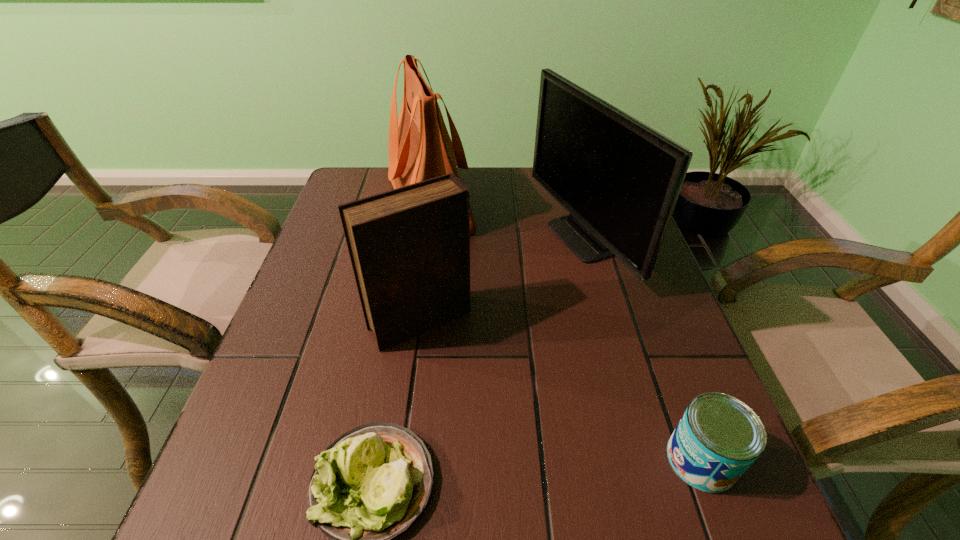
This screenshot has width=960, height=540. Identify the location of vacant point at the near edge. (433, 531).

I want to click on free space at the left edge of the desktop, so click(x=289, y=480).

Where is `free space at the right edge`? The width and height of the screenshot is (960, 540). free space at the right edge is located at coordinates [x=599, y=287].

In the image, there is a desktop. What are the coordinates of `vacant space at the near left corner` in the screenshot? It's located at (244, 500).

You are a GUI agent. You are given a task and a screenshot of the screen. Output one action in this format:
    pyautogui.click(x=<x>, y=<y>)
    Task: Click on the free space at the near right corner of the desktop
    This screenshot has height=540, width=960.
    Given the screenshot: What is the action you would take?
    pyautogui.click(x=721, y=529)

Image resolution: width=960 pixels, height=540 pixels. In order to click on vacant area that lies between the fourth tallest object and the third shortest object in this screenshot , I will do tap(561, 390).

Image resolution: width=960 pixels, height=540 pixels. In order to click on free area in between the second shortest object and the Bible in this screenshot , I will do `click(561, 390)`.

Find the location of a particular element. unoccupied position between the fourth tallest object and the computer monitor is located at coordinates (640, 349).

This screenshot has height=540, width=960. In order to click on vacant area between the fourth tallest object and the shopping bag in this screenshot , I will do [565, 332].

In order to click on free space between the fourth tallest object and the Bible in this screenshot , I will do `click(561, 390)`.